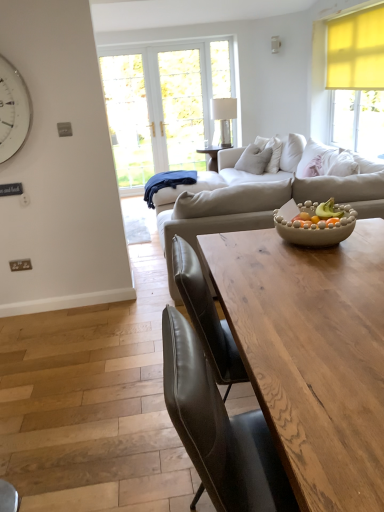
Measure the distance between point (319, 239) and camera.

The distance of point (319, 239) from camera is 1.87 meters.

What do you see at coordinates (314, 223) in the screenshot? The height and width of the screenshot is (512, 384). I see `beige textured bowl at center` at bounding box center [314, 223].

What do you see at coordinates (272, 152) in the screenshot? This screenshot has height=512, width=384. I see `light beige fabric pillow at center` at bounding box center [272, 152].

Where is `wooden table at center`? The height and width of the screenshot is (512, 384). wooden table at center is located at coordinates coord(312,355).

Considering the sizes of wooden table at center and clear glass lamp at center in the image, is wooden table at center wider or thinner than clear glass lamp at center?

wooden table at center is wider than clear glass lamp at center.

How different are the orientations of wooden table at center and clear glass lamp at center in degrees?

wooden table at center and clear glass lamp at center are facing 175 degrees away from each other.

Can you see wooden table at center touching clear glass lamp at center?

No, wooden table at center is not in contact with clear glass lamp at center.

Image resolution: width=384 pixels, height=512 pixels. In the image, there is a clear glass lamp at center. In order to click on coffee table below it (from the image's perspective) in this screenshot , I will do `click(312, 355)`.

Is light beige fabric pillow at center oriented towards wooden table at center?

No, light beige fabric pillow at center is not oriented towards wooden table at center.

Who is smaller, light beige fabric pillow at center or wooden table at center?

With smaller size is light beige fabric pillow at center.

Are light beige fabric pillow at center and wooden table at center located far from each other?

That's right, there is a large distance between light beige fabric pillow at center and wooden table at center.

The height and width of the screenshot is (512, 384). Identify the location of pillow on the right side of wooden table at center. (x=272, y=152).

Could you tell me if white metallic clock at upper left is facing light beige fabric pillow at center?

No.

Which object is closer to the camera taking this photo, white metallic clock at upper left or light beige fabric pillow at center?

Positioned in front is white metallic clock at upper left.

Which of these two, white metallic clock at upper left or light beige fabric pillow at center, is bigger?

light beige fabric pillow at center.

Which of these two, wooden table at center or beige textured bowl at center, is bigger?

Bigger between the two is wooden table at center.

In the scene shown: Is beige textured bowl at center at the back of wooden table at center?

No, beige textured bowl at center is not at the back of wooden table at center.

From a real-world perspective, which object stands above the other?

beige textured bowl at center.

Considering the sizes of wooden table at center and beige fabric couch at center in the image, is wooden table at center wider or thinner than beige fabric couch at center?

wooden table at center is thinner than beige fabric couch at center.

Is there a large distance between wooden table at center and beige fabric couch at center?

Yes, wooden table at center and beige fabric couch at center are located far from each other.

How far apart are wooden table at center and beige fabric couch at center?

The distance of wooden table at center from beige fabric couch at center is 1.27 meters.

Does light beige fabric pillow at center come behind white metallic clock at upper left?

Yes, it is.

Considering the positions of points (277, 156) and (17, 104), is point (277, 156) farther from camera compared to point (17, 104)?

Yes.

Is light beige fabric pillow at center at the right side of white metallic clock at upper left?

Yes.

Considering the positions of points (188, 208) and (280, 142), is point (188, 208) closer to camera compared to point (280, 142)?

Yes, point (188, 208) is closer to viewer.

In the image, is beige fabric couch at center positioned in front of or behind light beige fabric pillow at center?

Clearly, beige fabric couch at center is in front of light beige fabric pillow at center.

Is beige fabric couch at center next to light beige fabric pillow at center?

beige fabric couch at center and light beige fabric pillow at center are not in contact.

Is beige fabric couch at center turned away from light beige fabric pillow at center?

Yes, beige fabric couch at center's orientation is away from light beige fabric pillow at center.

Where is `coffee table lying in front of the clear glass lamp at center`? This screenshot has height=512, width=384. coffee table lying in front of the clear glass lamp at center is located at coordinates (312, 355).

Locate an element on the screen. The image size is (384, 512). pillow above the wooden table at center (from a real-world perspective) is located at coordinates (272, 152).

Which object lies further to the anchor point beige textured bowl at center, wooden table at center or beige fabric couch at center?

beige fabric couch at center.

Based on their spatial positions, is clear glass lamp at center or beige fabric couch at center closer to light beige fabric pillow at center?

The object closer to light beige fabric pillow at center is clear glass lamp at center.

When comparing their distances from white metallic clock at upper left, does clear glass lamp at center or beige fabric couch at center seem closer?

beige fabric couch at center lies closer to white metallic clock at upper left than the other object.

From the image, which object appears to be farther from clear glass lamp at center, light beige fabric pillow at center or beige textured bowl at center?

The object further to clear glass lamp at center is beige textured bowl at center.

From the picture: Estimate the real-world distances between objects in this image. Which object is closer to beige textured bowl at center, wooden table at center or white metallic clock at upper left?

wooden table at center is positioned closer to the anchor beige textured bowl at center.

Looking at the image, which one is located further to wooden table at center, light beige fabric pillow at center or beige textured bowl at center?

light beige fabric pillow at center is positioned further to the anchor wooden table at center.

Based on their spatial positions, is light beige fabric pillow at center or beige fabric couch at center closer to white metallic clock at upper left?

The object closer to white metallic clock at upper left is beige fabric couch at center.

Based on their spatial positions, is beige textured bowl at center or clear glass lamp at center closer to white metallic clock at upper left?

Among the two, beige textured bowl at center is located nearer to white metallic clock at upper left.

Find the location of `studio couch between wooden table at center and clear glass lamp at center along the z-axis`. studio couch between wooden table at center and clear glass lamp at center along the z-axis is located at coordinates (258, 201).

Where is `bowl between wooden table at center and beige fabric couch at center along the z-axis`? This screenshot has height=512, width=384. bowl between wooden table at center and beige fabric couch at center along the z-axis is located at coordinates (314, 223).

Find the location of a particular element. The image size is (384, 512). studio couch positioned between wooden table at center and light beige fabric pillow at center from near to far is located at coordinates (258, 201).

At what (x,y) coordinates should I click in order to perform the action: click on bowl between white metallic clock at upper left and beige fabric couch at center in the horizontal direction. Please return your answer as a coordinate pair (x, y). Looking at the image, I should click on (314, 223).